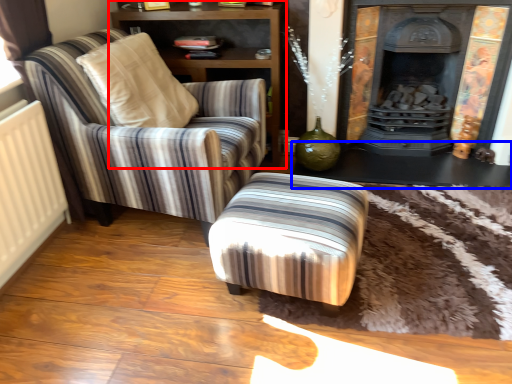
Question: Which point is closer to the camera, shelf (highlighted by a red box) or table (highlighted by a blue box)?

Choices:
 (A) shelf
 (B) table

Answer: (A)